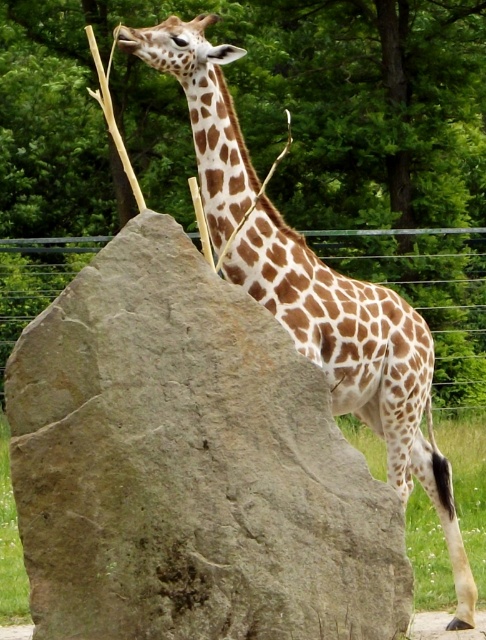
Image resolution: width=486 pixels, height=640 pixels. Describe the element at coordinates (189, 465) in the screenshot. I see `gray rough rock at center` at that location.

Between point (55, 496) and point (443, 364), which one is positioned behind?

The point (443, 364) is more distant.

The height and width of the screenshot is (640, 486). What do you see at coordinates (189, 465) in the screenshot? I see `gray rough rock at center` at bounding box center [189, 465].

Identify the location of gray rough rock at center. (189, 465).

Is spotted fur giraffe at center taller than green wire fence at upper center?

Yes, spotted fur giraffe at center is taller than green wire fence at upper center.

Identify the location of spotted fur giraffe at center. The height and width of the screenshot is (640, 486). (358, 362).

Consider the image. How much distance is there between gray rough rock at center and spotted fur giraffe at center?

A distance of 5.67 feet exists between gray rough rock at center and spotted fur giraffe at center.

Between gray rough rock at center and spotted fur giraffe at center, which one is positioned lower?

gray rough rock at center is below.

Image resolution: width=486 pixels, height=640 pixels. I want to click on gray rough rock at center, so click(189, 465).